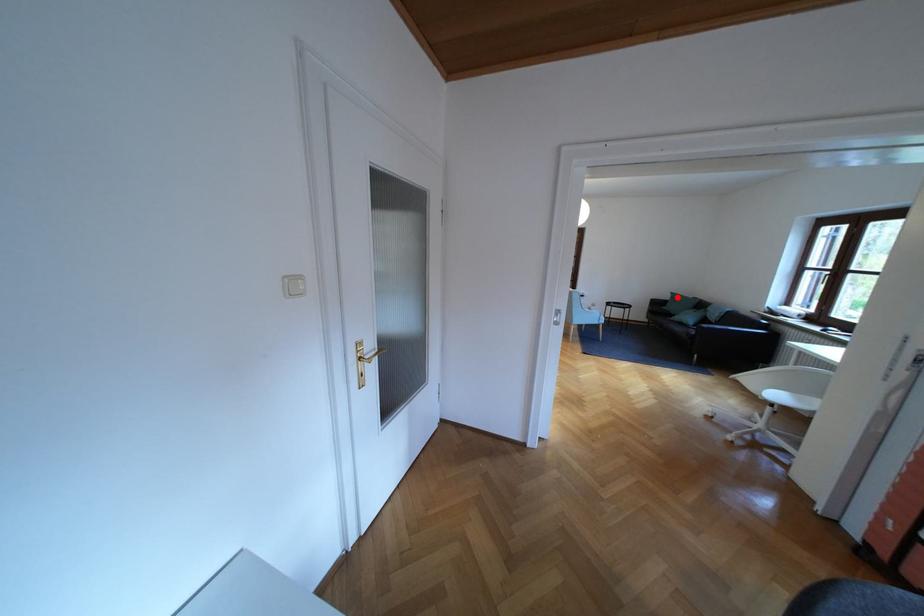
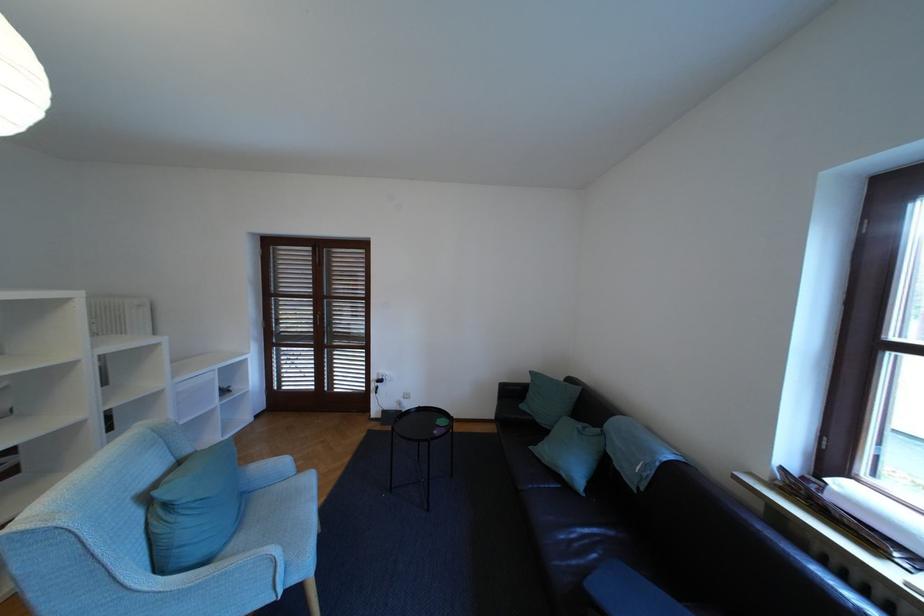
Find the pixel in the second image that matches the highlighted location in the first image.

(536, 379)